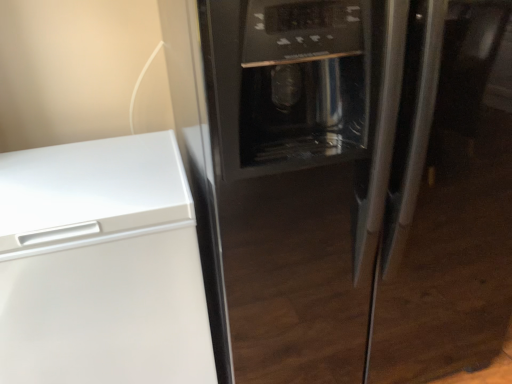
Question: Considering their positions, is white matte freezer at left located in front of or behind black glass refrigerator at center?

Choices:
 (A) behind
 (B) front

Answer: (A)

Question: Looking at their shapes, would you say white matte freezer at left is wider or thinner than black glass refrigerator at center?

Choices:
 (A) thin
 (B) wide

Answer: (A)

Question: In terms of size, does white matte freezer at left appear bigger or smaller than black glass refrigerator at center?

Choices:
 (A) small
 (B) big

Answer: (A)

Question: Is point (347, 59) positioned closer to the camera than point (172, 362)?

Choices:
 (A) farther
 (B) closer

Answer: (B)

Question: Considering the positions of black glass refrigerator at center and white matte freezer at left in the image, is black glass refrigerator at center bigger or smaller than white matte freezer at left?

Choices:
 (A) big
 (B) small

Answer: (A)

Question: From a real-world perspective, is black glass refrigerator at center positioned above or below white matte freezer at left?

Choices:
 (A) above
 (B) below

Answer: (A)

Question: Relative to white matte freezer at left, is black glass refrigerator at center in front or behind?

Choices:
 (A) behind
 (B) front

Answer: (B)